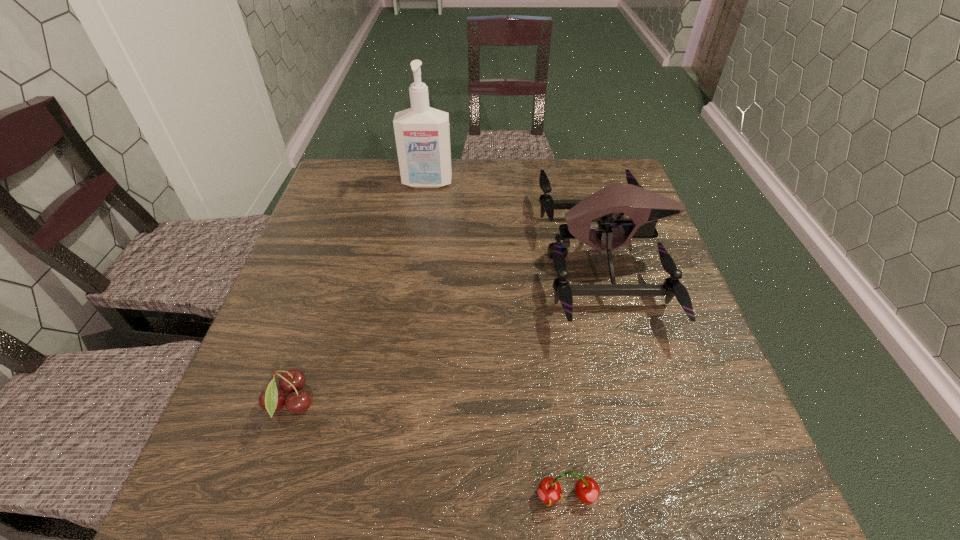
In order to click on vacant space located 0.230m on the front-facing side of the third nearest object in this screenshot , I will do [x=447, y=258].

The image size is (960, 540). I want to click on vacant space situated 0.090m on the front-facing side of the third nearest object, so click(505, 258).

What are the coordinates of `free space located on the leaves of the farther cherry` in the screenshot? It's located at (478, 403).

Locate an element on the screen. The height and width of the screenshot is (540, 960). cleansing agent at the far edge is located at coordinates (422, 134).

Locate an element on the screen. drone situated at the far edge is located at coordinates (644, 207).

At what (x,y) coordinates should I click in order to perform the action: click on object that is at the near edge. Please return your answer as a coordinate pair (x, y). The image size is (960, 540). Looking at the image, I should click on (587, 490).

What are the coordinates of `object positioned at the left edge` in the screenshot? It's located at (271, 400).

The height and width of the screenshot is (540, 960). I want to click on object at the right edge, so click(x=644, y=207).

Image resolution: width=960 pixels, height=540 pixels. I want to click on object at the far right corner, so click(644, 207).

In the image, there is a desktop. Where is `vacant space at the far edge`? vacant space at the far edge is located at coordinates (513, 179).